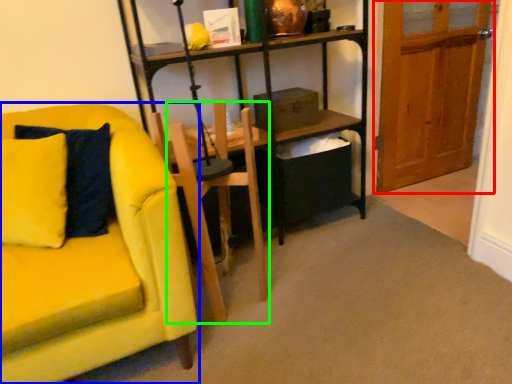
Question: Which is nearer to the door (highlighted by a red box)? chair (highlighted by a blue box) or armchair (highlighted by a green box).

Choices:
 (A) chair
 (B) armchair

Answer: (B)